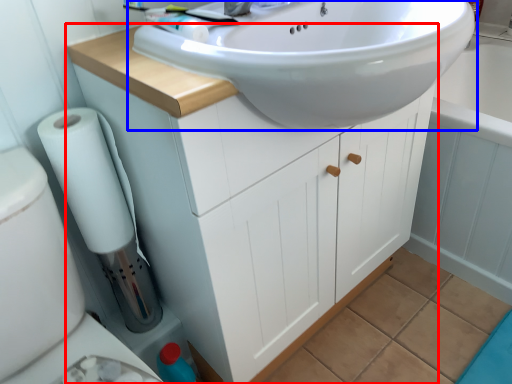
Question: Which point is further to the camera, bathroom cabinet (highlighted by a red box) or sink (highlighted by a blue box)?

Choices:
 (A) bathroom cabinet
 (B) sink

Answer: (A)